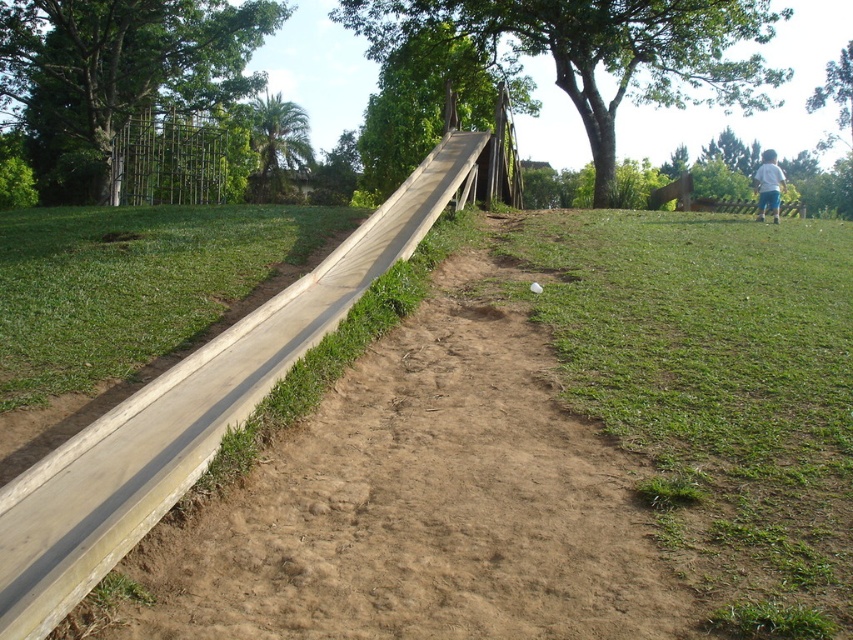
Can you confirm if green grass at lower right is shorter than green leafy tree at upper center?

Correct, green grass at lower right is not as tall as green leafy tree at upper center.

Does green grass at lower right appear under green leafy tree at upper center?

Yes.

Identify the location of green grass at lower right. (718, 394).

Where is `green grass at lower right`? The image size is (853, 640). green grass at lower right is located at coordinates (718, 394).

Between green leafy palm at upper left and white cotton shirt at upper right, which one appears on the left side from the viewer's perspective?

green leafy palm at upper left is more to the left.

Can you confirm if green leafy palm at upper left is positioned above white cotton shirt at upper right?

Yes, green leafy palm at upper left is above white cotton shirt at upper right.

You are a GUI agent. You are given a task and a screenshot of the screen. Output one action in this format:
    pyautogui.click(x=<x>, y=<y>)
    Task: Click on the green leafy palm at upper left
    
    Given the screenshot: What is the action you would take?
    pyautogui.click(x=276, y=145)

Identify the location of green leafy palm at upper left. The image size is (853, 640). (276, 145).

Measure the distance between wooden ramp at center and green leafy tree at upper left.

wooden ramp at center is 21.89 meters away from green leafy tree at upper left.

Does wooden ramp at center appear on the left side of green leafy tree at upper left?

No, wooden ramp at center is not to the left of green leafy tree at upper left.

Which is in front, point (294, 304) or point (245, 81)?

Point (294, 304) is more forward.

Find the location of `wooden ramp at center`. wooden ramp at center is located at coordinates (190, 413).